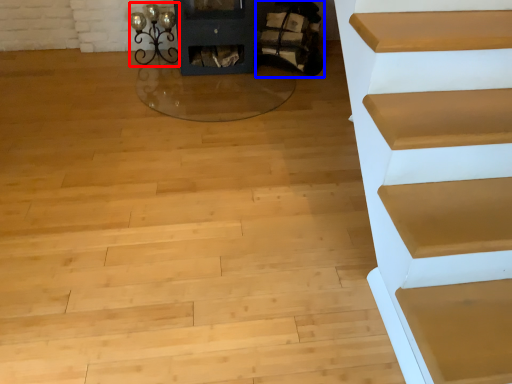
Question: Which object is closer to the camera taking this photo, light (highlighted by a red box) or chair (highlighted by a blue box)?

Choices:
 (A) light
 (B) chair

Answer: (B)